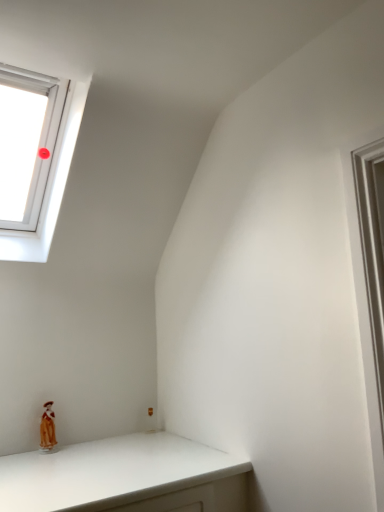
The width and height of the screenshot is (384, 512). I want to click on white plastic window at upper left, so click(50, 186).

The image size is (384, 512). Describe the element at coordinates (50, 186) in the screenshot. I see `white plastic window at upper left` at that location.

Measure the distance between point (36, 257) and camera.

Point (36, 257) and camera are 1.73 meters apart from each other.

Describe the element at coordinates (47, 428) in the screenshot. Image resolution: width=384 pixels, height=512 pixels. I see `porcelain doll at lower left` at that location.

Where is `porcelain doll at lower left`? The width and height of the screenshot is (384, 512). porcelain doll at lower left is located at coordinates (47, 428).

Find the location of a particular element. This screenshot has width=384, height=512. white plastic window at upper left is located at coordinates (50, 186).

Is porcelain doll at lower left to the left of white plastic window at upper left from the viewer's perspective?

No.

Does porcelain doll at lower left come behind white plastic window at upper left?

Yes.

Does point (46, 426) come closer to viewer compared to point (57, 196)?

Yes.

From the image's perspective, is porcelain doll at lower left positioned above or below white plastic window at upper left?

From the image's perspective, porcelain doll at lower left appears below white plastic window at upper left.

From a real-world perspective, is porcelain doll at lower left positioned under white plastic window at upper left based on gravity?

Yes, from a real-world perspective, porcelain doll at lower left is beneath white plastic window at upper left.

In the scene shown: Does porcelain doll at lower left have a greater width compared to white plastic window at upper left?

No.

Considering the sizes of porcelain doll at lower left and white plastic window at upper left in the image, is porcelain doll at lower left taller or shorter than white plastic window at upper left?

In the image, porcelain doll at lower left appears to be shorter than white plastic window at upper left.

Is porcelain doll at lower left smaller than white plastic window at upper left?

Correct, porcelain doll at lower left occupies less space than white plastic window at upper left.

Is porcelain doll at lower left completely or partially outside of white plastic window at upper left?

That's correct, porcelain doll at lower left is outside of white plastic window at upper left.

Is the surface of porcelain doll at lower left in direct contact with white plastic window at upper left?

No, porcelain doll at lower left is not touching white plastic window at upper left.

Is porcelain doll at lower left facing towards white plastic window at upper left?

No.

How different are the orientations of porcelain doll at lower left and white plastic window at upper left in degrees?

The facing directions of porcelain doll at lower left and white plastic window at upper left are 0.0744 degrees apart.

How distant is porcelain doll at lower left from white plastic window at upper left?

31.12 inches.

The height and width of the screenshot is (512, 384). Find the location of `window lying in front of the porcelain doll at lower left`. window lying in front of the porcelain doll at lower left is located at coordinates (50, 186).

Between white plastic window at upper left and porcelain doll at lower left, which one appears on the right side from the viewer's perspective?

Positioned to the right is porcelain doll at lower left.

Who is more distant, white plastic window at upper left or porcelain doll at lower left?

porcelain doll at lower left is behind.

Which is in front, point (46, 217) or point (53, 416)?

The point (53, 416) is more forward.

From the image's perspective, is white plastic window at upper left positioned above or below porcelain doll at lower left?

From the image's perspective, white plastic window at upper left appears above porcelain doll at lower left.

From a real-world perspective, is white plastic window at upper left over porcelain doll at lower left?

Yes, from a real-world perspective, white plastic window at upper left is above porcelain doll at lower left.

Which object is thinner, white plastic window at upper left or porcelain doll at lower left?

Thinner between the two is porcelain doll at lower left.

Considering the sizes of objects white plastic window at upper left and porcelain doll at lower left in the image provided, who is shorter, white plastic window at upper left or porcelain doll at lower left?

With less height is porcelain doll at lower left.

Is white plastic window at upper left bigger or smaller than porcelain doll at lower left?

In the image, white plastic window at upper left appears to be larger than porcelain doll at lower left.

Is white plastic window at upper left spatially inside porcelain doll at lower left, or outside of it?

white plastic window at upper left lies outside porcelain doll at lower left.

Is white plastic window at upper left positioned far away from porcelain doll at lower left?

Actually, white plastic window at upper left and porcelain doll at lower left are a little close together.

Based on the photo, is white plastic window at upper left looking in the opposite direction of porcelain doll at lower left?

white plastic window at upper left is not turned away from porcelain doll at lower left.

Identify the location of doll below the white plastic window at upper left (from the image's perspective). The width and height of the screenshot is (384, 512). (47, 428).

Find the location of a particular element. The width and height of the screenshot is (384, 512). window in front of the porcelain doll at lower left is located at coordinates (50, 186).

Locate an element on the screen. The image size is (384, 512). doll behind the white plastic window at upper left is located at coordinates (47, 428).